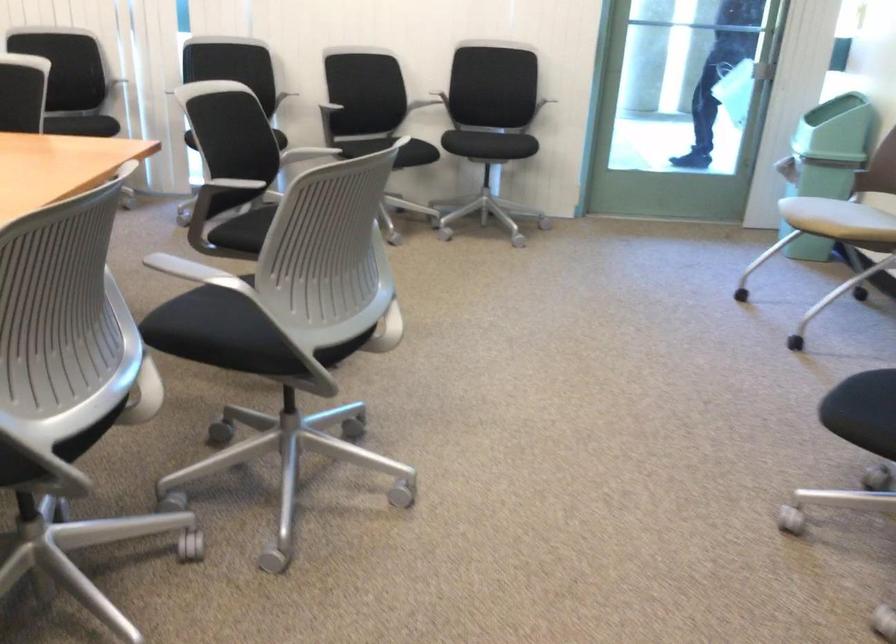
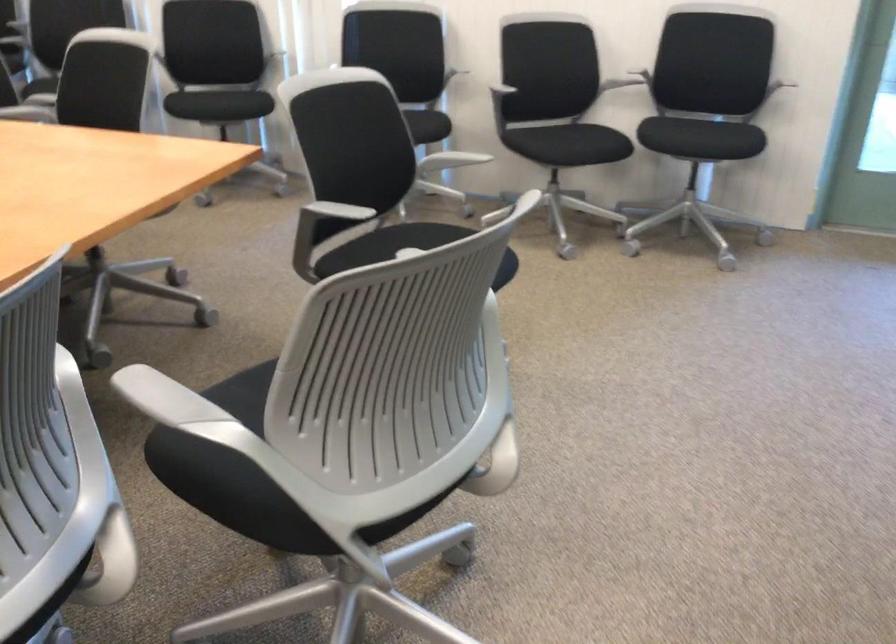
The point at (x=391, y=317) is marked in the first image. Where is the corresponding point in the second image?

(496, 448)